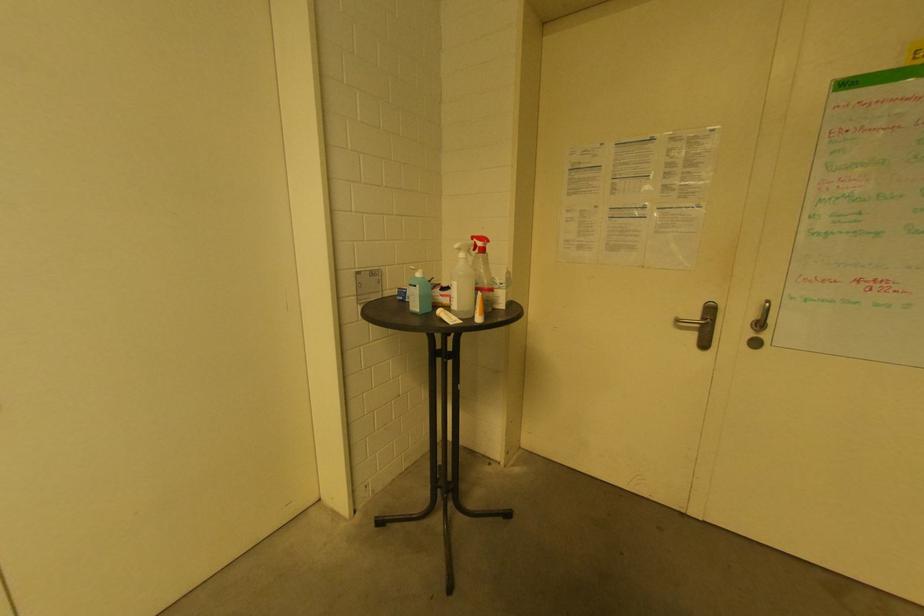
This screenshot has width=924, height=616. Describe the element at coordinates (761, 317) in the screenshot. I see `the small silver handle` at that location.